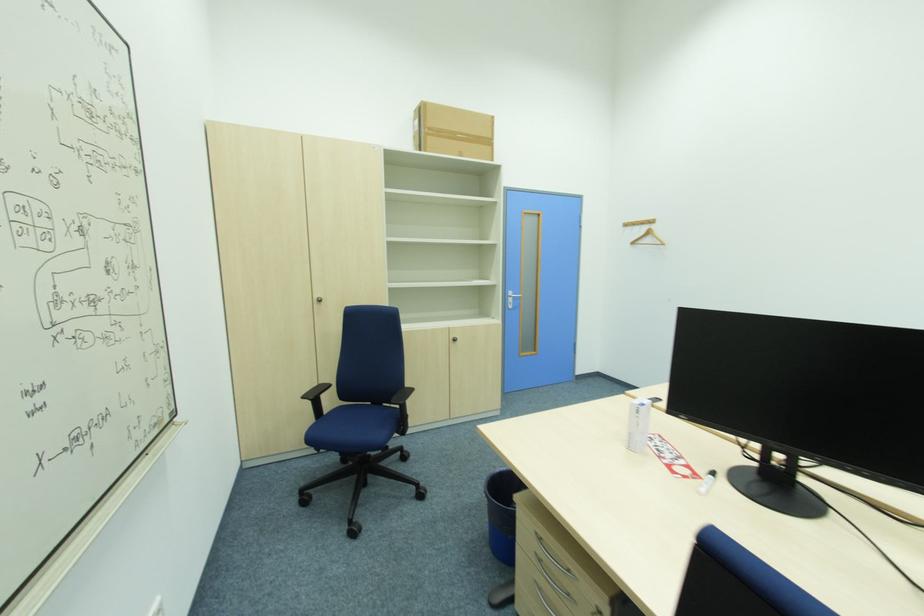
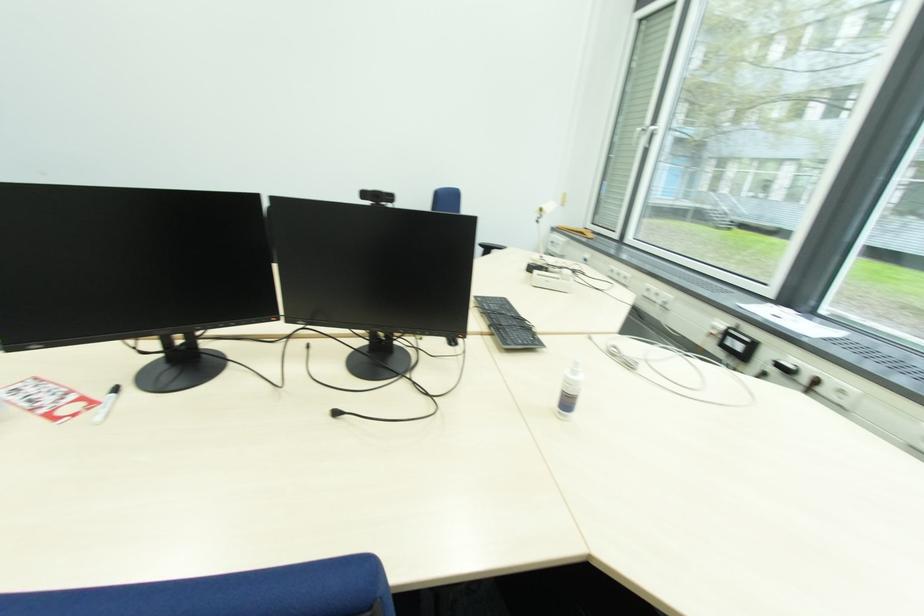
Locate, in the second image, the point that corresponds to (716,476) in the first image.

(118, 392)